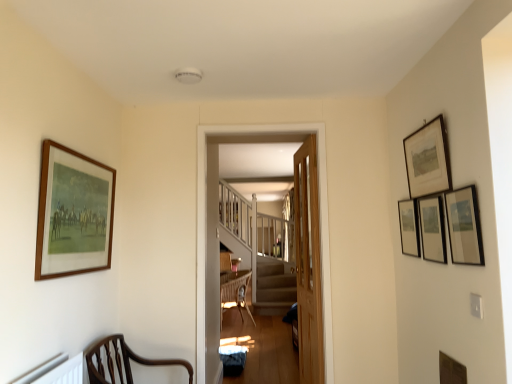
Question: Is matte black picture frame at upper right, acting as the 4th picture frame starting from the right, not within matte black picture frame at upper right, the 3th picture frame positioned from the right?

Choices:
 (A) yes
 (B) no

Answer: (A)

Question: Could you tell me if matte black picture frame at upper right, which is the 3th picture frame from left to right, is turned towards matte black picture frame at upper right, the 3th picture frame positioned from the right?

Choices:
 (A) no
 (B) yes

Answer: (A)

Question: Considering the relative sizes of matte black picture frame at upper right, which is the 3th picture frame from left to right, and matte black picture frame at upper right, the fourth picture frame positioned from the left, in the image provided, is matte black picture frame at upper right, which is the 3th picture frame from left to right, taller than matte black picture frame at upper right, the fourth picture frame positioned from the left,?

Choices:
 (A) no
 (B) yes

Answer: (A)

Question: Is matte black picture frame at upper right, which is the 3th picture frame from left to right, not close to matte black picture frame at upper right, the 3th picture frame positioned from the right?

Choices:
 (A) yes
 (B) no

Answer: (B)

Question: Is matte black picture frame at upper right, acting as the 4th picture frame starting from the right, to the left of matte black picture frame at upper right, the fourth picture frame positioned from the left, from the viewer's perspective?

Choices:
 (A) yes
 (B) no

Answer: (A)

Question: Does matte black picture frame at upper right, which is the 3th picture frame from left to right, have a smaller size compared to matte black picture frame at upper right, the fourth picture frame positioned from the left?

Choices:
 (A) yes
 (B) no

Answer: (B)

Question: From a real-world perspective, is wooden picture frame at lower right, which is the first picture frame in right-to-left order, over brown wood chair at lower left?

Choices:
 (A) yes
 (B) no

Answer: (A)

Question: Could you tell me if wooden picture frame at lower right, arranged as the 6th picture frame when viewed from the left, is facing brown wood chair at lower left?

Choices:
 (A) no
 (B) yes

Answer: (B)

Question: Is wooden picture frame at lower right, arranged as the 6th picture frame when viewed from the left, positioned far away from brown wood chair at lower left?

Choices:
 (A) no
 (B) yes

Answer: (B)

Question: Can you confirm if wooden picture frame at lower right, arranged as the 6th picture frame when viewed from the left, is wider than brown wood chair at lower left?

Choices:
 (A) yes
 (B) no

Answer: (B)

Question: Is wooden picture frame at lower right, which is the first picture frame in right-to-left order, completely or partially outside of brown wood chair at lower left?

Choices:
 (A) no
 (B) yes

Answer: (B)

Question: Does wooden picture frame at lower right, which is the first picture frame in right-to-left order, have a larger size compared to brown wood chair at lower left?

Choices:
 (A) no
 (B) yes

Answer: (A)

Question: Is matte black picture frame at upper right, the fourth picture frame positioned from the left, at the back of light brown wooden door at center?

Choices:
 (A) yes
 (B) no

Answer: (B)